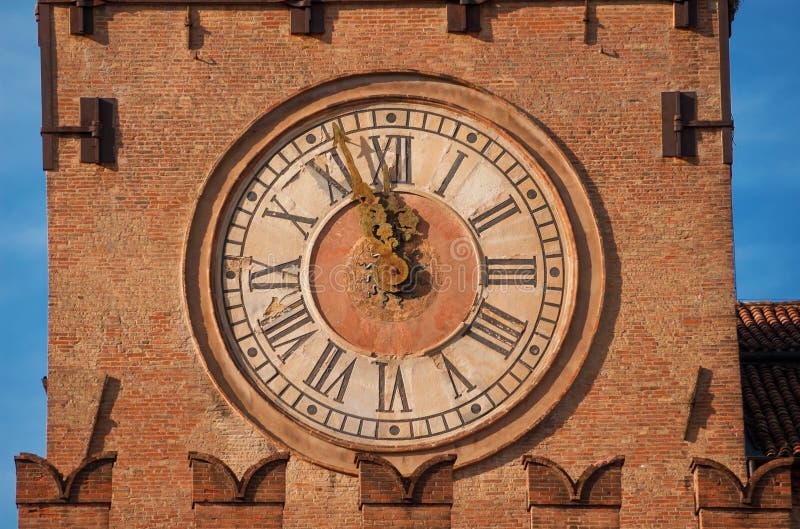
Locate an element on the screen. This screenshot has width=800, height=529. clock face is located at coordinates (344, 305).